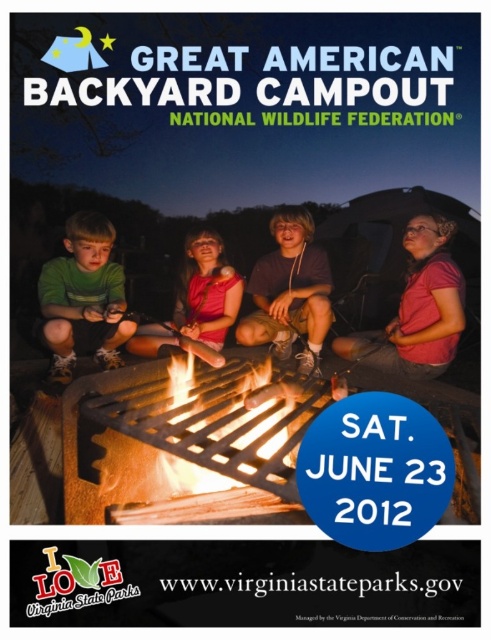
Question: Among these points, which one is farthest from the camera?

Choices:
 (A) (275, 321)
 (B) (99, 336)
 (C) (241, 298)
 (D) (415, 236)

Answer: (C)

Question: Does pink fabric shirt at center have a smaller size compared to pink fabric dress at center?

Choices:
 (A) no
 (B) yes

Answer: (A)

Question: Does matte pink shirt at center lie in front of pink fabric dress at center?

Choices:
 (A) no
 (B) yes

Answer: (B)

Question: Which object is the closest to the green matte shirt at center?

Choices:
 (A) pink fabric dress at center
 (B) pink fabric shirt at center
 (C) matte pink shirt at center

Answer: (A)

Question: Is green matte shirt at center thinner than matte pink shirt at center?

Choices:
 (A) no
 (B) yes

Answer: (B)

Question: Which point is farther to the camera?

Choices:
 (A) pink fabric dress at center
 (B) green matte shirt at center

Answer: (A)